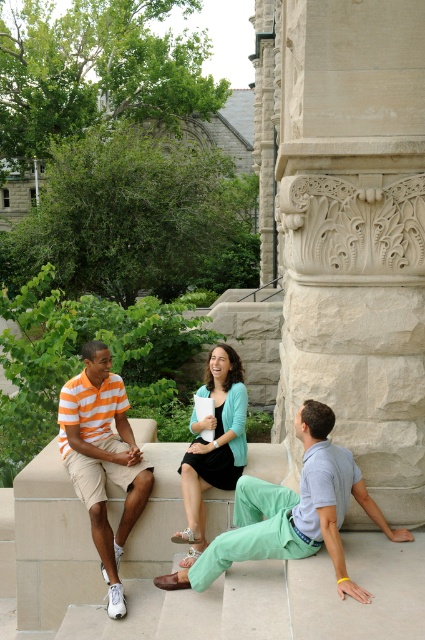
Question: Does light green cotton pants at center have a larger size compared to teal jersey at center?

Choices:
 (A) yes
 (B) no

Answer: (A)

Question: Which object is the closest to the light green cotton pants at center?

Choices:
 (A) teal jersey at center
 (B) orange striped shirt at left

Answer: (A)

Question: Can you confirm if light green cotton pants at center is thinner than orange striped shirt at left?

Choices:
 (A) yes
 (B) no

Answer: (B)

Question: Estimate the real-world distances between objects in this image. Which object is farther from the orange striped shirt at left?

Choices:
 (A) light green cotton pants at center
 (B) teal jersey at center

Answer: (A)

Question: Which of the following is the farthest from the observer?

Choices:
 (A) (223, 436)
 (B) (119, 580)

Answer: (A)

Question: Can you confirm if light green cotton pants at center is positioned to the left of teal jersey at center?

Choices:
 (A) no
 (B) yes

Answer: (A)